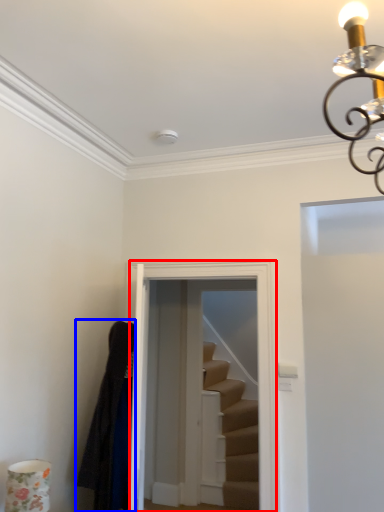
Question: Among these objects, which one is nearest to the camera, glass door (highlighted by a red box) or robe (highlighted by a blue box)?

Choices:
 (A) glass door
 (B) robe

Answer: (B)